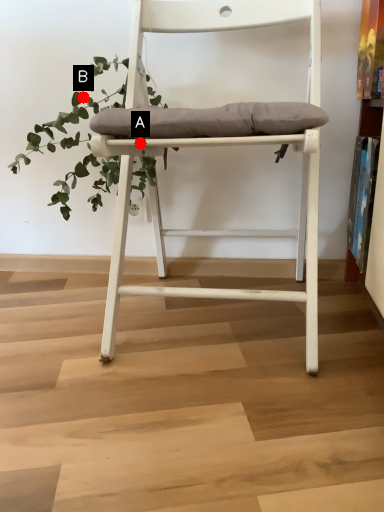
Question: Two points are circled on the image, labeled by A and B beside each circle. Which point is closer to the camera?

Choices:
 (A) A is closer
 (B) B is closer

Answer: (A)